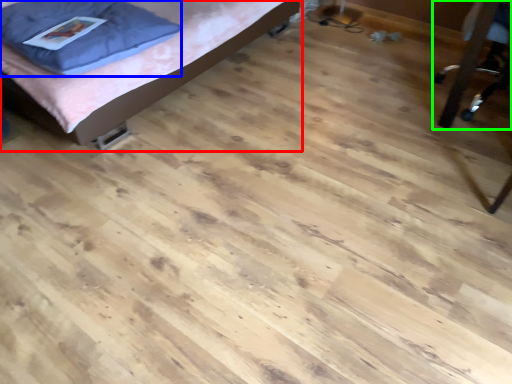
Question: Which is nearer to the bed (highlighted by a red box)? pillow (highlighted by a blue box) or furniture (highlighted by a green box).

Choices:
 (A) pillow
 (B) furniture

Answer: (A)